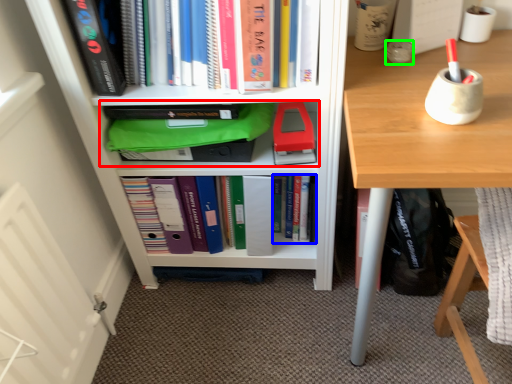
Question: Considering the real-world distances, which object is farthest from shelf (highlighted by a red box)? book (highlighted by a blue box) or stationery (highlighted by a green box)?

Choices:
 (A) book
 (B) stationery

Answer: (B)